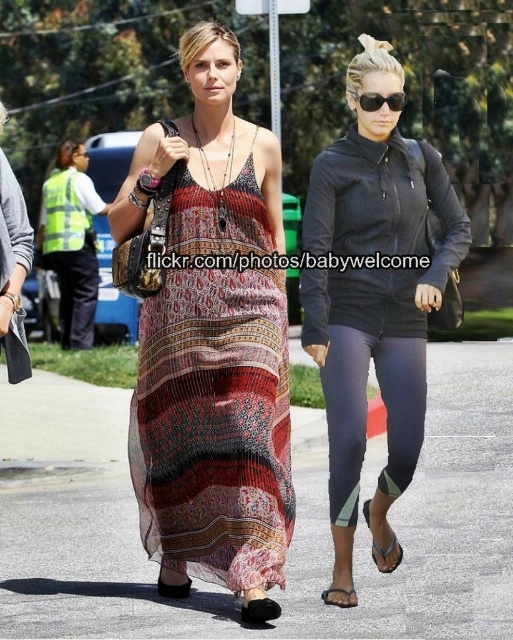
You are a photographer trying to capture the printed chiffon maxi dress at center and the black plastic sunglasses at upper center in the same frame. Based on their positions, which object should you adjust your camera to focus on first to ensure both are in the frame?

The printed chiffon maxi dress at center is to the left of the black plastic sunglasses at upper center, so you should focus on the printed chiffon maxi dress at center first to ensure both are included in the frame.

Looking at this image, you are a photographer trying to capture both the printed chiffon dress at center and the black plastic sunglasses at upper center in the same frame. Which object should you focus on first to ensure both are in the frame?

You should focus on the printed chiffon dress at center first because it is wider than the black plastic sunglasses at upper center, so centering it will allow the smaller sunglasses to fit into the frame more easily.